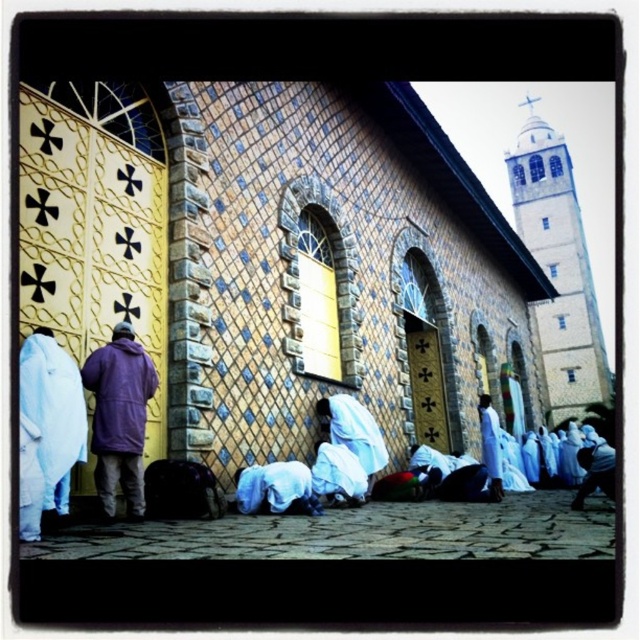
This screenshot has height=640, width=640. Describe the element at coordinates (52, 413) in the screenshot. I see `white matte robe at lower left` at that location.

Can you confirm if white matte robe at lower left is wider than white cotton robe at center?

Yes, white matte robe at lower left is wider than white cotton robe at center.

Is point (26, 538) farther from viewer compared to point (323, 451)?

No, it is not.

Find the location of a particular element. Image resolution: width=640 pixels, height=640 pixels. white matte robe at lower left is located at coordinates (52, 413).

Can you confirm if yellow tiled church at center is wider than white matte robe at lower left?

Correct, the width of yellow tiled church at center exceeds that of white matte robe at lower left.

Between point (93, 193) and point (77, 419), which one is positioned behind?

Point (93, 193)

Locate an element on the screen. The height and width of the screenshot is (640, 640). yellow tiled church at center is located at coordinates (305, 260).

Is purple fleece jacket at left below white matte robe at lower left?

Indeed, purple fleece jacket at left is positioned under white matte robe at lower left.

Who is positioned more to the left, purple fleece jacket at left or white matte robe at lower left?

white matte robe at lower left is more to the left.

The height and width of the screenshot is (640, 640). Find the location of `purple fleece jacket at left`. purple fleece jacket at left is located at coordinates click(120, 417).